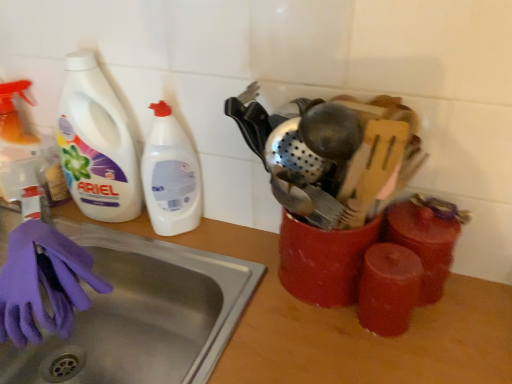
What do you see at coordinates (142, 314) in the screenshot? This screenshot has width=512, height=384. I see `stainless steel sink at lower left` at bounding box center [142, 314].

Identify the location of purple rubber glove at lower left. (42, 283).

Looking at this image, measure the distance between purple rubber glove at lower left and camera.

23.59 inches.

At what (x,y) coordinates should I click in order to perform the action: click on stainless steel sink at lower left. Please return your answer as a coordinate pair (x, y). Image resolution: width=512 pixels, height=384 pixels. Looking at the image, I should click on (142, 314).

Between stainless steel sink at lower left and white plastic bottle at left, which one has more height?

With more height is white plastic bottle at left.

From a real-world perspective, which is physically below, stainless steel sink at lower left or white plastic bottle at left?

stainless steel sink at lower left is physically lower.

Can you confirm if stainless steel sink at lower left is wider than white plastic bottle at left?

Indeed, stainless steel sink at lower left has a greater width compared to white plastic bottle at left.

From the image's perspective, which is above, stainless steel sink at lower left or white plastic bottle at left?

white plastic bottle at left appears higher in the image.

Which object is wider, wooden counter top at center or purple rubber glove at lower left?

wooden counter top at center is wider.

What's the angular difference between wooden counter top at center and purple rubber glove at lower left's facing directions?

The angle between the facing direction of wooden counter top at center and the facing direction of purple rubber glove at lower left is 2.26 degrees.

Which point is more distant from viewer, (241,322) or (106,287)?

The point (106,287) is more distant.

Is the surface of purple rubber glove at lower left in direct contact with stainless steel sink at lower left?

No, purple rubber glove at lower left is not touching stainless steel sink at lower left.

The width and height of the screenshot is (512, 384). I want to click on glove located above the stainless steel sink at lower left (from the image's perspective), so click(42, 283).

Is purple rubber glove at lower left not inside stainless steel sink at lower left?

That's incorrect, purple rubber glove at lower left is not completely outside stainless steel sink at lower left.

Considering the sizes of objects white plastic bottle at left and white plastic bottle at left in the image provided, who is shorter, white plastic bottle at left or white plastic bottle at left?

With less height is white plastic bottle at left.

Can you confirm if white plastic bottle at left is thinner than white plastic bottle at left?

Correct, the width of white plastic bottle at left is less than that of white plastic bottle at left.

From the picture: Is white plastic bottle at left turned away from white plastic bottle at left?

white plastic bottle at left is not turned away from white plastic bottle at left.

Which of these two, wooden counter top at center or stainless steel sink at lower left, stands shorter?

Standing shorter between the two is stainless steel sink at lower left.

Is wooden counter top at center closer to camera compared to stainless steel sink at lower left?

Yes, wooden counter top at center is closer to the camera.

Considering the relative sizes of wooden counter top at center and stainless steel sink at lower left in the image provided, is wooden counter top at center bigger than stainless steel sink at lower left?

Indeed, wooden counter top at center has a larger size compared to stainless steel sink at lower left.

The image size is (512, 384). In order to click on cleaning product above the stainless steel sink at lower left (from the image's perspective) in this screenshot , I will do `click(170, 175)`.

Does white plastic bottle at left contain stainless steel sink at lower left?

Definitely not — stainless steel sink at lower left is not inside white plastic bottle at left.

Between white plastic bottle at left and stainless steel sink at lower left, which one has more height?

white plastic bottle at left.

How different are the orientations of white plastic bottle at left and stainless steel sink at lower left in degrees?

There is a 1.7-degree angle between the facing directions of white plastic bottle at left and stainless steel sink at lower left.

Does point (67, 238) come closer to viewer compared to point (267, 335)?

No, (67, 238) is behind (267, 335).

From a real-world perspective, is purple rubber glove at lower left under wooden counter top at center?

Actually, purple rubber glove at lower left is physically above wooden counter top at center in the real world.

Can you confirm if purple rubber glove at lower left is bigger than wooden counter top at center?

Actually, purple rubber glove at lower left might be smaller than wooden counter top at center.

Does purple rubber glove at lower left lie behind wooden counter top at center?

Yes, purple rubber glove at lower left is further from the viewer.

Identify the location of cleaning product that is above the stainless steel sink at lower left (from a real-world perspective). Image resolution: width=512 pixels, height=384 pixels. (170, 175).

Find the location of `counter top below the purple rubber glove at lower left (from a real-world perspective)`. counter top below the purple rubber glove at lower left (from a real-world perspective) is located at coordinates (351, 326).

Which object lies further to the anchor point white plastic bottle at left, purple rubber glove at lower left or white plastic bottle at left?

Among the two, purple rubber glove at lower left is located further to white plastic bottle at left.

Estimate the real-world distances between objects in this image. Which object is further from white plastic bottle at left, wooden counter top at center or stainless steel sink at lower left?

wooden counter top at center lies further to white plastic bottle at left than the other object.

Which object lies nearer to the anchor point white plastic bottle at left, wooden counter top at center or stainless steel sink at lower left?

Based on the image, stainless steel sink at lower left appears to be nearer to white plastic bottle at left.

Looking at this image, considering their positions, is stainless steel sink at lower left positioned closer to white plastic bottle at left than white plastic bottle at left?

white plastic bottle at left.

Looking at the image, which one is located closer to purple rubber glove at lower left, stainless steel sink at lower left or wooden counter top at center?

stainless steel sink at lower left.

From the image, which object appears to be farther from white plastic bottle at left, wooden counter top at center or white plastic bottle at left?

Among the two, wooden counter top at center is located further to white plastic bottle at left.

Considering their positions, is stainless steel sink at lower left positioned closer to wooden counter top at center than white plastic bottle at left?

Based on the image, stainless steel sink at lower left appears to be nearer to wooden counter top at center.

Looking at the image, which one is located closer to wooden counter top at center, white plastic bottle at left or purple rubber glove at lower left?

Based on the image, white plastic bottle at left appears to be nearer to wooden counter top at center.

Locate an element on the screen. The width and height of the screenshot is (512, 384). glove between white plastic bottle at left and wooden counter top at center from top to bottom is located at coordinates (42, 283).

Identify the location of sink between purple rubber glove at lower left and wooden counter top at center vertically. The image size is (512, 384). (142, 314).

You are a GUI agent. You are given a task and a screenshot of the screen. Output one action in this format:
    pyautogui.click(x=<x>, y=<y>)
    Task: Click on the cleaning product between white plastic bottle at left and wooden counter top at center from top to bottom
    Image resolution: width=512 pixels, height=384 pixels.
    Given the screenshot: What is the action you would take?
    pyautogui.click(x=170, y=175)

Find the location of a particular element. cleaning product that lies between white plastic bottle at left and stainless steel sink at lower left from top to bottom is located at coordinates (170, 175).